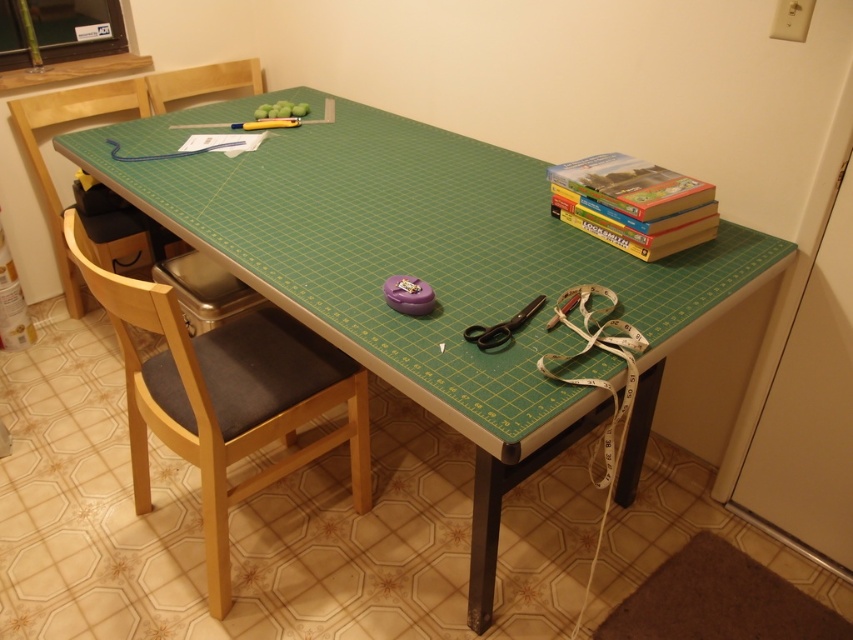
Question: Where is wooden chair at left located in relation to black plastic scissors at center in the image?

Choices:
 (A) below
 (B) above

Answer: (B)

Question: Is wooden chair at center above wooden chair at upper left?

Choices:
 (A) no
 (B) yes

Answer: (A)

Question: Which object appears closest to the camera in this image?

Choices:
 (A) wooden chair at center
 (B) wooden chair at left
 (C) hardcover books at upper right

Answer: (A)

Question: Which point is closer to the camera taking this photo?

Choices:
 (A) (251, 406)
 (B) (143, 104)

Answer: (A)

Question: Among these objects, which one is nearest to the camera?

Choices:
 (A) hardcover books at upper right
 (B) brown felt mat at lower right
 (C) black plastic scissors at center
 (D) wooden chair at upper left

Answer: (C)

Question: Considering the relative positions of wooden chair at left and black plastic scissors at center in the image provided, where is wooden chair at left located with respect to black plastic scissors at center?

Choices:
 (A) left
 (B) right

Answer: (A)